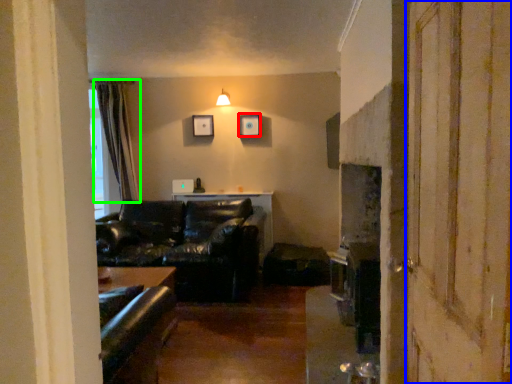
Question: Estimate the real-world distances between objects in this image. Which object is closer to picture frame (highlighted by a red box), screen door (highlighted by a blue box) or curtain (highlighted by a green box)?

Choices:
 (A) screen door
 (B) curtain

Answer: (B)